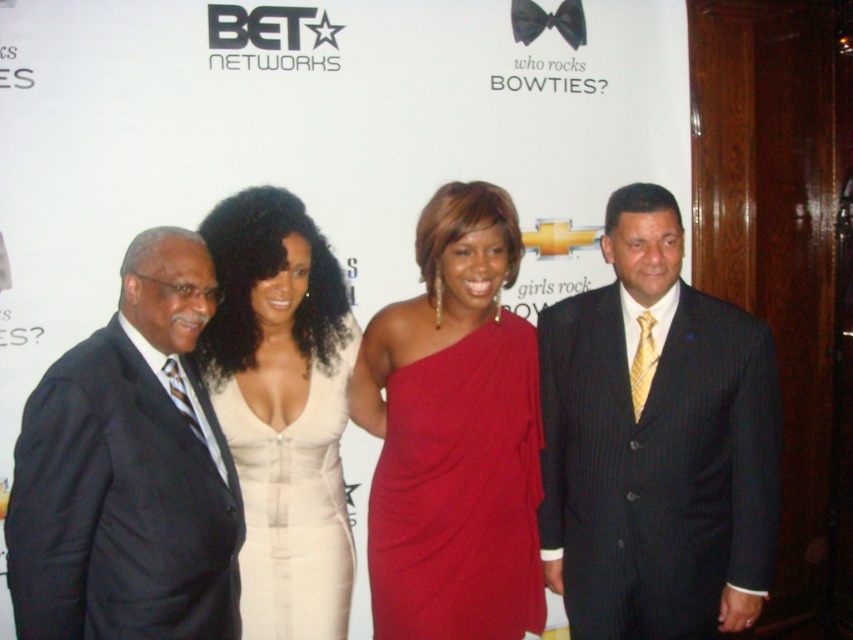
Question: Which point is farther to the camera?

Choices:
 (A) satin red dress at center
 (B) dark blue pinstripe suit at center

Answer: (B)

Question: Estimate the real-world distances between objects in this image. Which object is farther from the black satin bow tie at upper center?

Choices:
 (A) dark blue pinstripe suit at center
 (B) white satin dress at center
 (C) satin red dress at center
 (D) dark blue suit at left

Answer: (D)

Question: Is dark blue pinstripe suit at center to the right of dark blue suit at left from the viewer's perspective?

Choices:
 (A) yes
 (B) no

Answer: (A)

Question: In this image, where is dark blue suit at left located relative to satin red dress at center?

Choices:
 (A) below
 (B) above

Answer: (A)

Question: Estimate the real-world distances between objects in this image. Which object is closer to the dark blue pinstripe suit at center?

Choices:
 (A) satin red dress at center
 (B) black satin bow tie at upper center
 (C) dark blue suit at left
 (D) white satin dress at center

Answer: (A)

Question: Does dark blue pinstripe suit at center appear under dark blue suit at left?

Choices:
 (A) yes
 (B) no

Answer: (A)